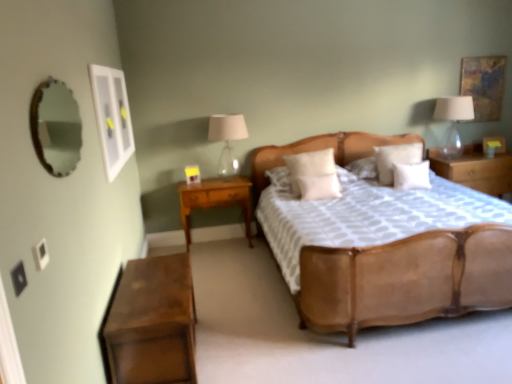
Locate an element on the screen. This screenshot has height=384, width=512. vacant area that lies between wooden nightstand at lower left, the third nightstand from the right, and leather bed at center is located at coordinates (260, 313).